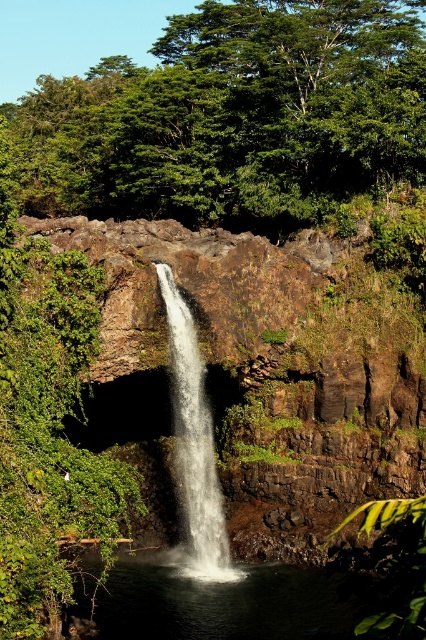
Question: From the image, what is the correct spatial relationship of clear water at center in relation to translucent white water at center?

Choices:
 (A) left
 (B) right

Answer: (B)

Question: Can you confirm if green leafy tree at upper center is thinner than translucent white water at center?

Choices:
 (A) yes
 (B) no

Answer: (B)

Question: Which of the following is the farthest from the observer?

Choices:
 (A) (204, 90)
 (B) (158, 275)

Answer: (A)

Question: Which object is closer to the camera taking this photo?

Choices:
 (A) green leafy tree at upper center
 (B) clear water at center

Answer: (B)

Question: Which object is the closest to the clear water at center?

Choices:
 (A) translucent white water at center
 (B) green leafy tree at upper center

Answer: (A)

Question: Is green leafy tree at upper center bigger than translucent white water at center?

Choices:
 (A) no
 (B) yes

Answer: (B)